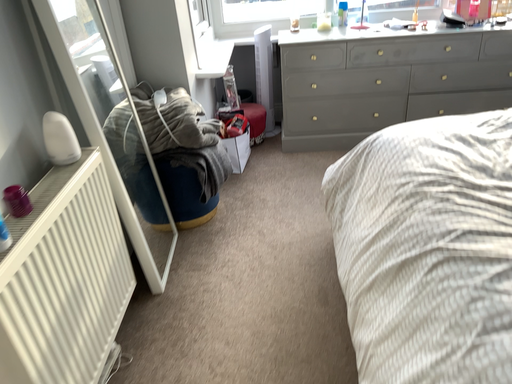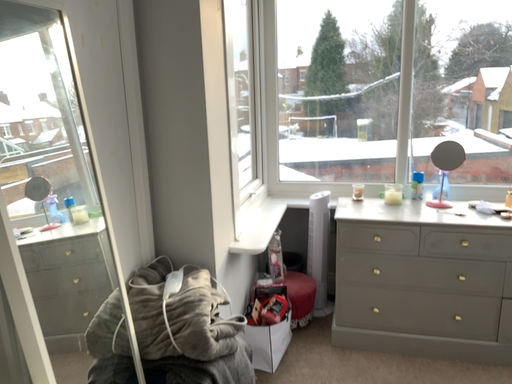
Question: Which way did the camera rotate in the video?

Choices:
 (A) rotated left
 (B) rotated right

Answer: (A)